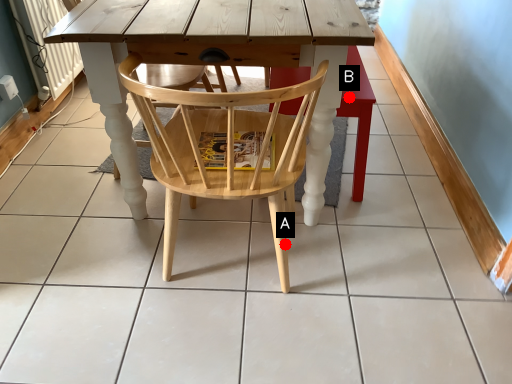
Question: Two points are circled on the image, labeled by A and B beside each circle. Which point is closer to the camera taking this photo?

Choices:
 (A) A is closer
 (B) B is closer

Answer: (A)